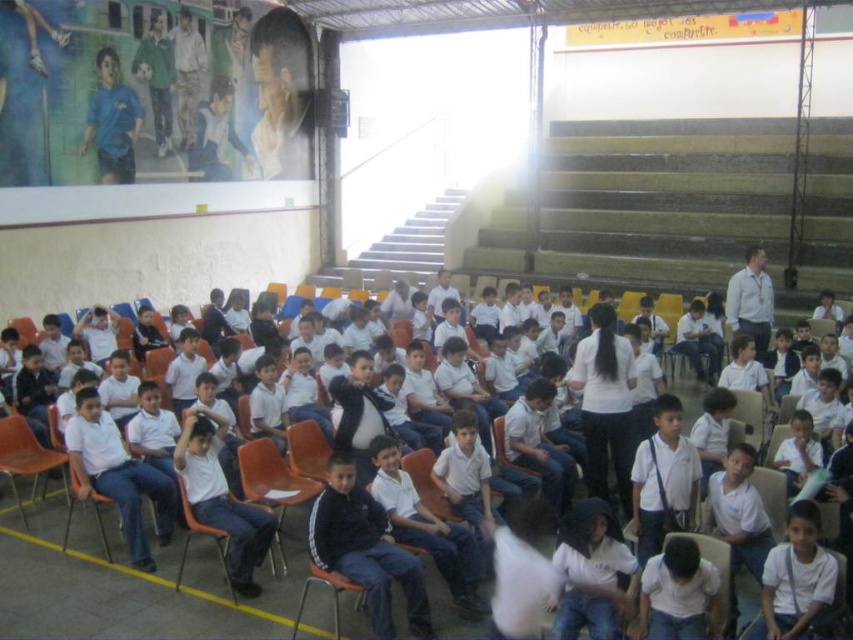
Is white matte shirt at center further to camera compared to white matte shirt at lower right?

No.

Is white matte shirt at center taller than white matte shirt at lower right?

Correct, white matte shirt at center is much taller as white matte shirt at lower right.

You are a GUI agent. You are given a task and a screenshot of the screen. Output one action in this format:
    pyautogui.click(x=<x>, y=<y>)
    Task: Click on the white matte shirt at center
    
    Given the screenshot: What is the action you would take?
    pyautogui.click(x=593, y=573)

Measure the distance between white matte shirt at lower center and matte blue shirt at upper left.

white matte shirt at lower center is 10.29 meters away from matte blue shirt at upper left.

Between point (683, 580) and point (120, 81), which one is positioned in front?

Point (683, 580) is in front.

Does point (683, 604) lie in front of point (119, 129)?

Yes, point (683, 604) is closer to viewer.

The width and height of the screenshot is (853, 640). In order to click on white matte shirt at lower center in this screenshot , I will do `click(677, 593)`.

Is white cotton shirt at center smaller than matte blue shirt at upper left?

No.

Where is `white cotton shirt at center`? This screenshot has height=640, width=853. white cotton shirt at center is located at coordinates click(128, 582).